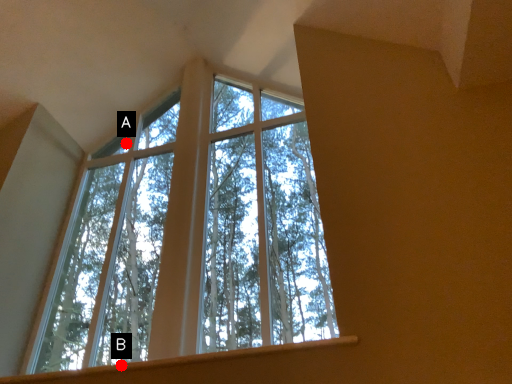
Question: Two points are circled on the image, labeled by A and B beside each circle. Among these points, which one is nearest to the camera?

Choices:
 (A) A is closer
 (B) B is closer

Answer: (B)